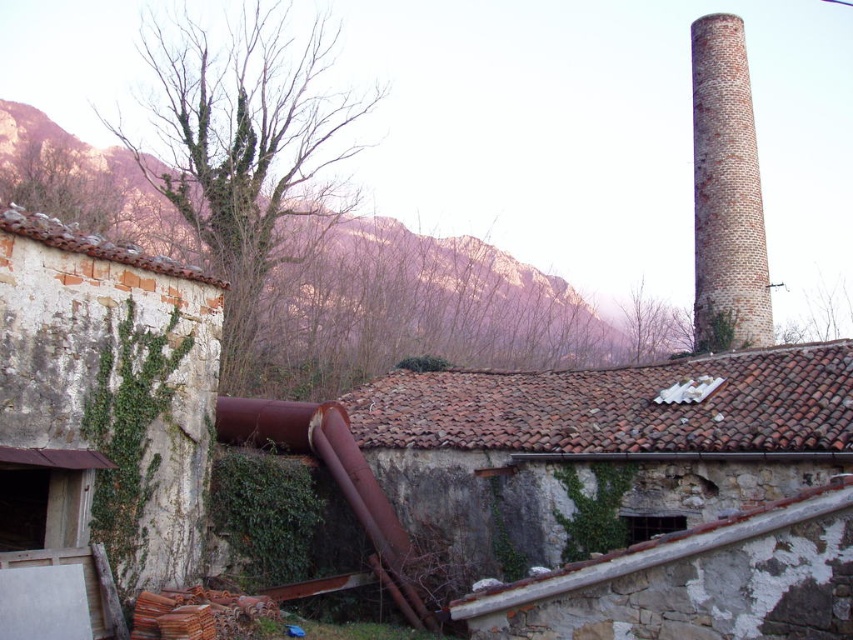
Question: Which point is farther to the camera?

Choices:
 (A) (727, 310)
 (B) (351, 451)

Answer: (A)

Question: Estimate the real-world distances between objects in this image. Which object is closer to the brown rocky mountain at upper left?

Choices:
 (A) brick chimney at upper right
 (B) rusty metal pipe at lower center

Answer: (A)

Question: Is brown rocky mountain at upper left further to camera compared to rusty metal pipe at lower center?

Choices:
 (A) yes
 (B) no

Answer: (A)

Question: Which point appears closest to the camera in this image?

Choices:
 (A) (730, 330)
 (B) (521, 332)
 (C) (374, 541)

Answer: (C)

Question: Is brick chimney at upper right positioned before rusty metal pipe at lower center?

Choices:
 (A) yes
 (B) no

Answer: (B)

Question: Does brown rocky mountain at upper left appear under brick chimney at upper right?

Choices:
 (A) yes
 (B) no

Answer: (A)